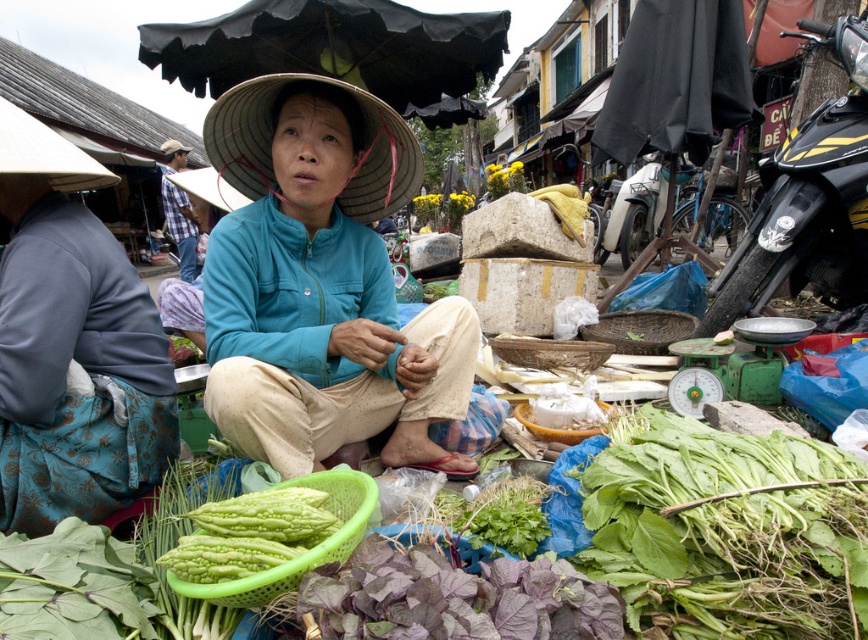
Who is positioned more to the left, matte teal jacket at center or woven straw hat at center?

From the viewer's perspective, woven straw hat at center appears more on the left side.

Is the position of matte teal jacket at center less distant than that of woven straw hat at center?

No.

Measure the distance between point (380, 385) and camera.

They are 2.09 meters apart.

Where is `matte teal jacket at center`? The width and height of the screenshot is (868, 640). matte teal jacket at center is located at coordinates (321, 284).

Who is lower down, woven straw hat at center or brown woven hat at center?

woven straw hat at center

Does woven straw hat at center appear under brown woven hat at center?

Yes, woven straw hat at center is below brown woven hat at center.

Is point (279, 77) farther from camera compared to point (176, 145)?

No.

Image resolution: width=868 pixels, height=640 pixels. In order to click on woven straw hat at center in this screenshot , I will do `click(271, 138)`.

Is green leafy at center to the right of blue plaid shirt at upper left from the viewer's perspective?

Yes, green leafy at center is to the right of blue plaid shirt at upper left.

Is point (708, 461) in front of point (173, 232)?

Yes, point (708, 461) is in front of point (173, 232).

Between point (783, 632) and point (188, 260), which one is positioned in front?

Point (783, 632) is more forward.

The width and height of the screenshot is (868, 640). Find the location of `green leafy at center`. green leafy at center is located at coordinates (725, 531).